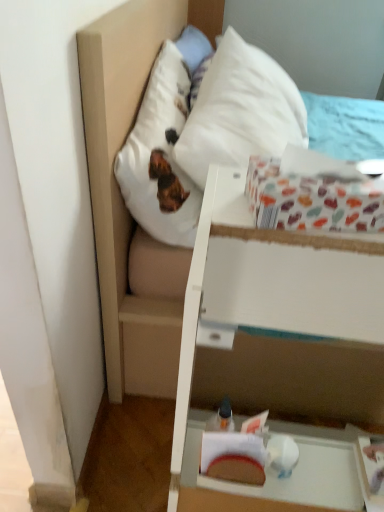
Question: Is white matte vanity at lower right oriented away from white soft pillow at upper center?

Choices:
 (A) yes
 (B) no

Answer: (A)

Question: Is white matte vanity at lower right positioned beyond the bounds of white soft pillow at upper center?

Choices:
 (A) yes
 (B) no

Answer: (A)

Question: Can you confirm if white matte vanity at lower right is thinner than white soft pillow at upper center?

Choices:
 (A) no
 (B) yes

Answer: (B)

Question: Does white matte vanity at lower right have a lesser height compared to white soft pillow at upper center?

Choices:
 (A) yes
 (B) no

Answer: (B)

Question: Is white matte vanity at lower right positioned behind white soft pillow at upper center?

Choices:
 (A) no
 (B) yes

Answer: (A)

Question: Does white matte vanity at lower right appear on the left side of white soft pillow at upper center?

Choices:
 (A) no
 (B) yes

Answer: (A)

Question: From a real-world perspective, is multicolored paper at upper right located beneath white soft pillow at upper center?

Choices:
 (A) no
 (B) yes

Answer: (A)

Question: Considering the relative sizes of multicolored paper at upper right and white soft pillow at upper center in the image provided, is multicolored paper at upper right smaller than white soft pillow at upper center?

Choices:
 (A) no
 (B) yes

Answer: (B)

Question: Is multicolored paper at upper right turned away from white soft pillow at upper center?

Choices:
 (A) yes
 (B) no

Answer: (A)

Question: Is white soft pillow at upper center inside multicolored paper at upper right?

Choices:
 (A) no
 (B) yes

Answer: (A)

Question: From the image's perspective, is multicolored paper at upper right beneath white soft pillow at upper center?

Choices:
 (A) no
 (B) yes

Answer: (B)

Question: Is multicolored paper at upper right facing towards white soft pillow at upper center?

Choices:
 (A) no
 (B) yes

Answer: (A)

Question: From a real-world perspective, is multicolored paper at upper right located beneath white matte vanity at lower right?

Choices:
 (A) yes
 (B) no

Answer: (B)